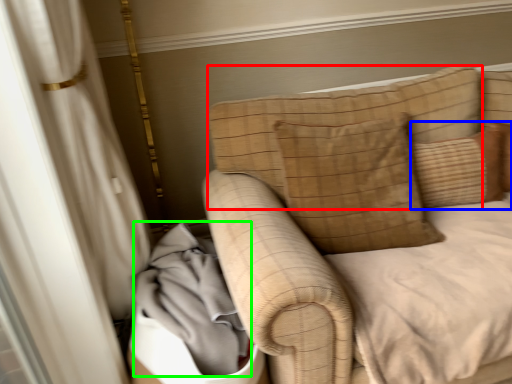
Question: Based on their relative distances, which object is farther from pillow (highlighted by a red box)? Choose from pillow (highlighted by a blue box) and material (highlighted by a green box).

Choices:
 (A) pillow
 (B) material

Answer: (B)